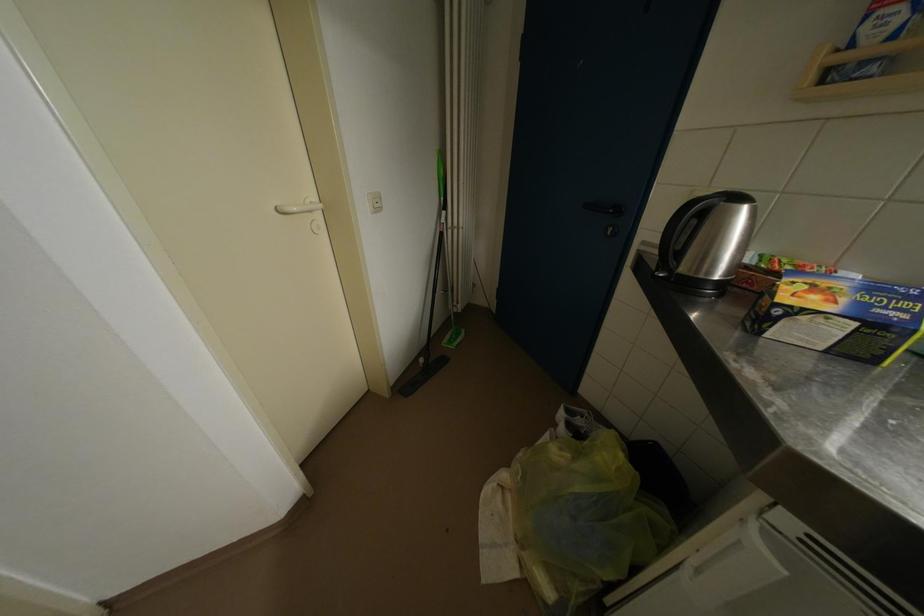
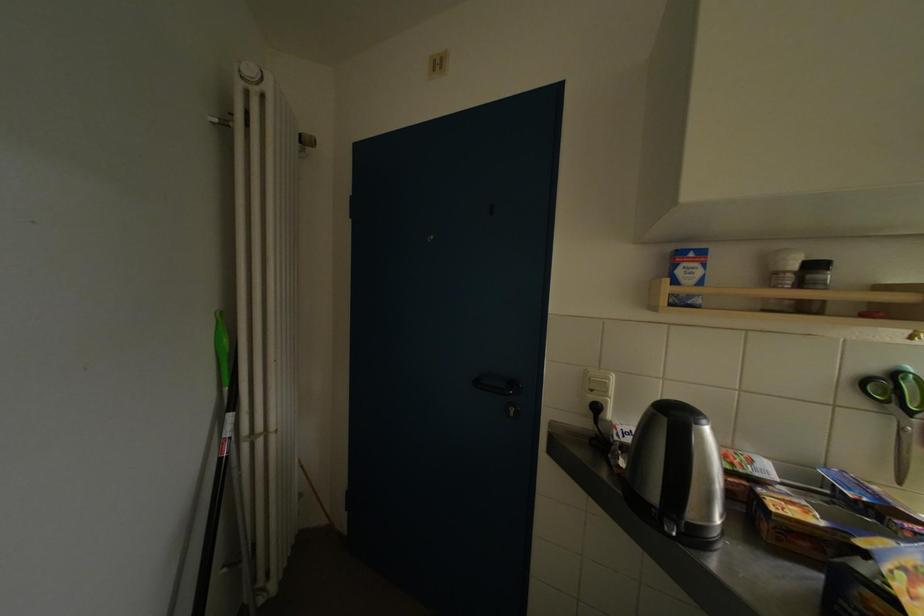
Where in the second image is the point corresponding to point (874, 30) from the first image?

(686, 276)